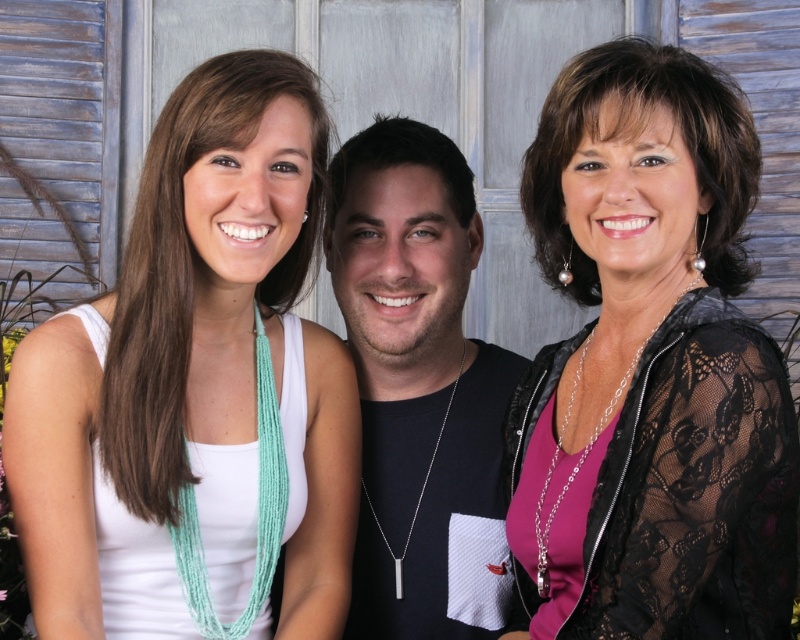
Question: Is the position of pink lace jacket at upper right more distant than that of black matte shirt at center?

Choices:
 (A) no
 (B) yes

Answer: (A)

Question: Which object is the farthest from the white fabric tank top at left?

Choices:
 (A) black matte shirt at center
 (B) pink lace jacket at upper right

Answer: (B)

Question: Does white fabric tank top at left have a lesser width compared to black matte shirt at center?

Choices:
 (A) no
 (B) yes

Answer: (A)

Question: Is white fabric tank top at left positioned in front of black matte shirt at center?

Choices:
 (A) no
 (B) yes

Answer: (B)

Question: Which object is the farthest from the black matte shirt at center?

Choices:
 (A) white fabric tank top at left
 (B) pink lace jacket at upper right

Answer: (B)

Question: Which point is farther to the camera?

Choices:
 (A) (86, 572)
 (B) (670, 244)

Answer: (A)